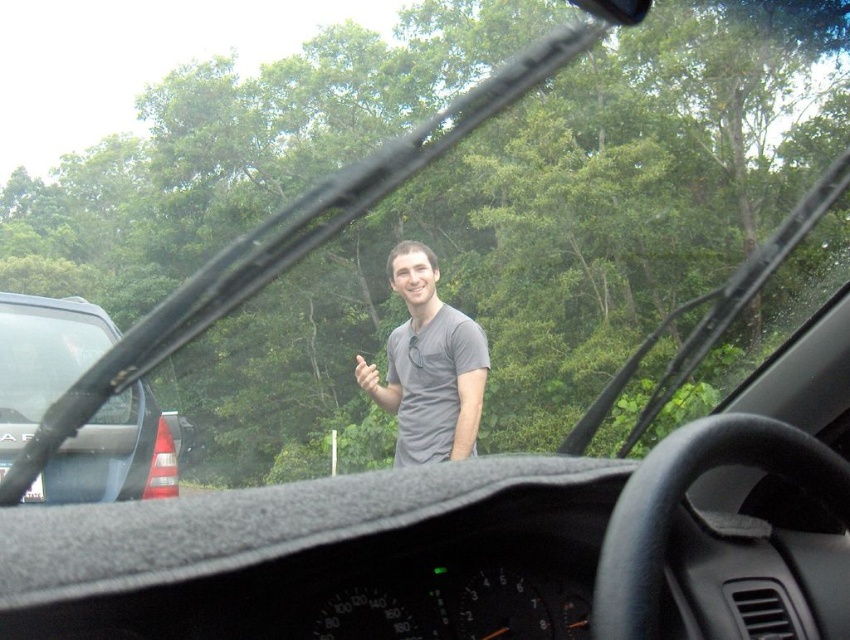
Question: Which point is farther to the camera?

Choices:
 (A) (105, 404)
 (B) (370, 364)
 (C) (471, 340)

Answer: (B)

Question: Does satin black car at left come in front of matte gray hand at center?

Choices:
 (A) yes
 (B) no

Answer: (B)

Question: Which of the following is the closest to the observer?

Choices:
 (A) (446, 308)
 (B) (360, 356)

Answer: (A)

Question: Can you confirm if satin black car at left is wider than matte gray hand at center?

Choices:
 (A) yes
 (B) no

Answer: (B)

Question: Which point is closer to the camera?

Choices:
 (A) (374, 387)
 (B) (480, 336)

Answer: (B)

Question: Can you confirm if gray matte shirt at center is wider than matte gray hand at center?

Choices:
 (A) yes
 (B) no

Answer: (B)